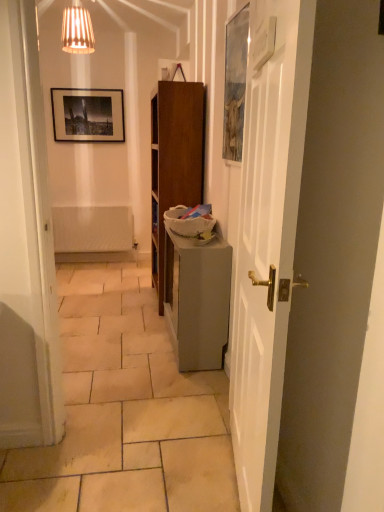
Where is `space that is in front of matte gray table at center`? Image resolution: width=384 pixels, height=512 pixels. space that is in front of matte gray table at center is located at coordinates (160, 386).